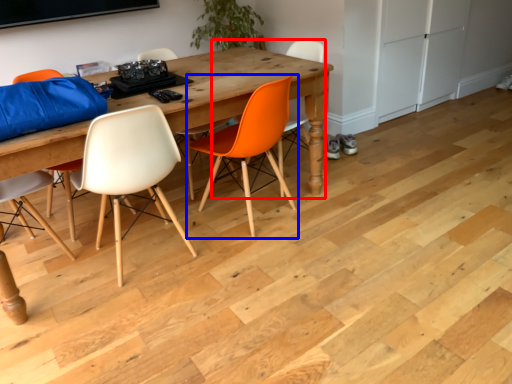
Question: Which of the following is the farthest to the observer, chair (highlighted by a red box) or chair (highlighted by a blue box)?

Choices:
 (A) chair
 (B) chair

Answer: (A)